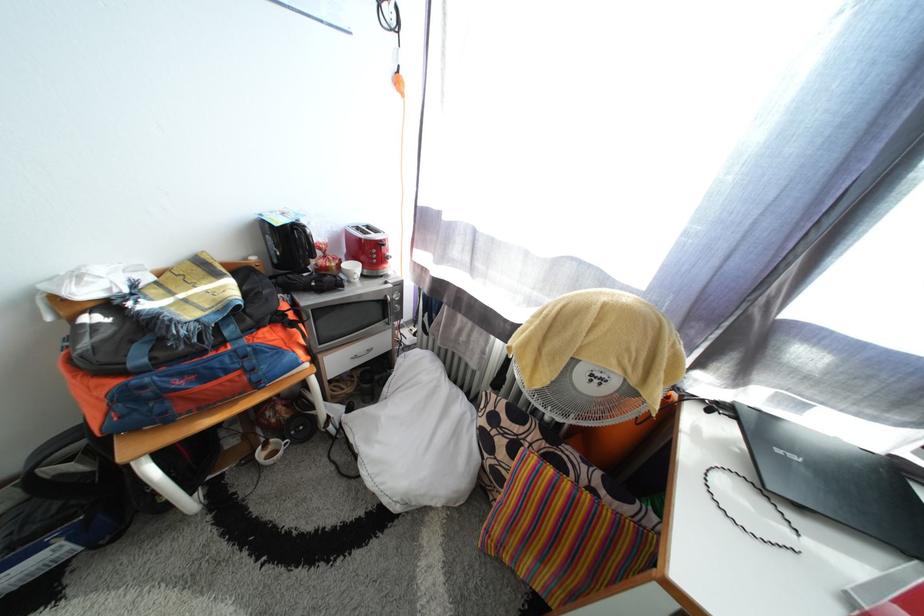
Locate an element on the screen. orange electrical plug is located at coordinates pyautogui.click(x=398, y=83).